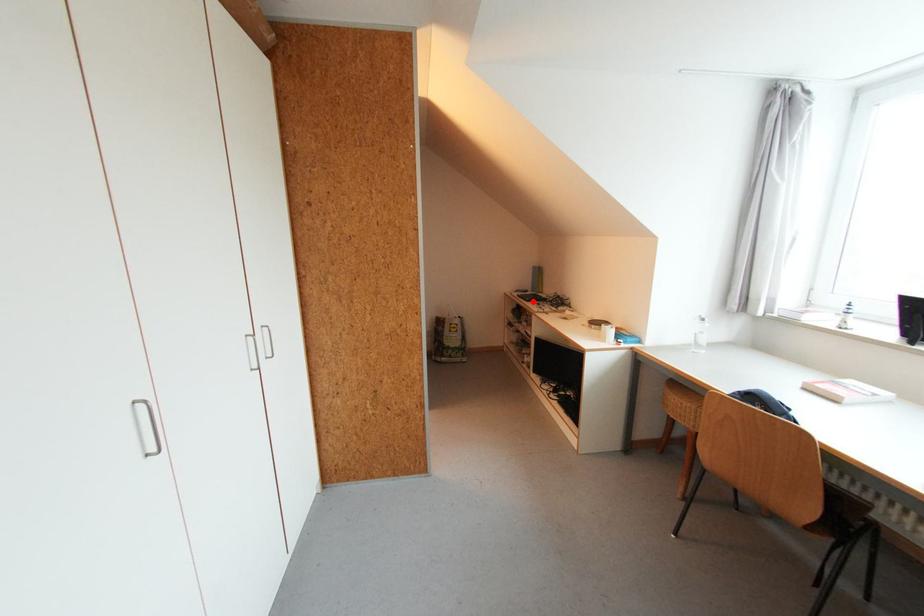
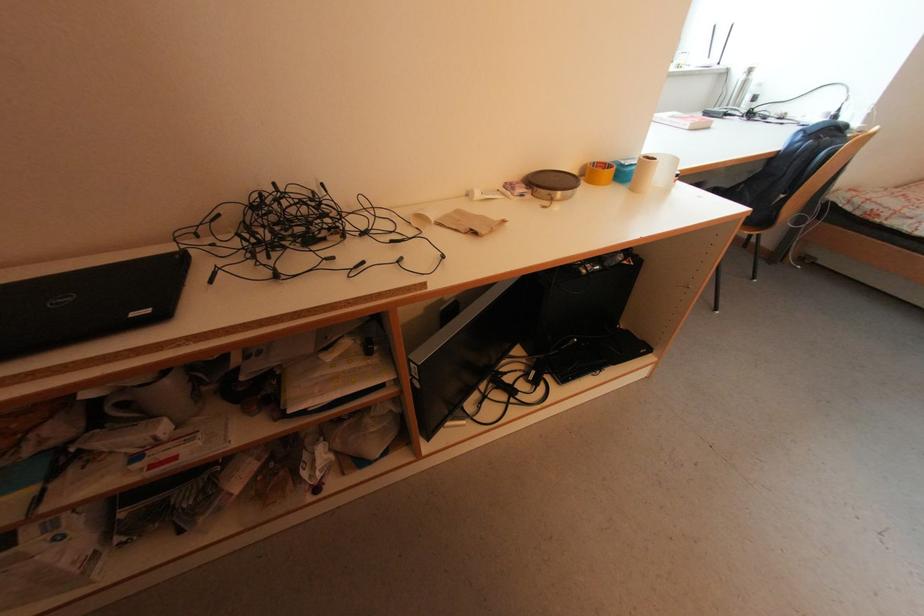
Locate, in the second image, the point that corresponds to the highlighted location in the first image.

(168, 317)